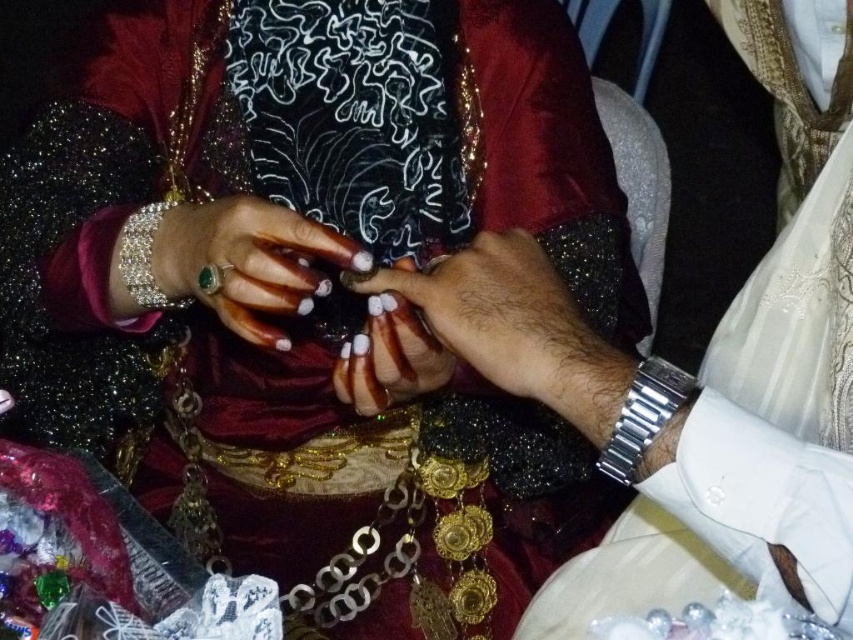
Question: Among these points, which one is farthest from the camera?

Choices:
 (A) (498, 380)
 (B) (375, 333)
 (C) (560, 323)
 (D) (259, 307)

Answer: (B)

Question: Which point is farther to the camera?

Choices:
 (A) silver metallic bracelet at left
 (B) shiny black glove at center
 (C) shiny gold necklace at center

Answer: (A)

Question: Which point appears closest to the camera in this image?

Choices:
 (A) (531, 253)
 (B) (165, 202)
 (C) (315, 280)
 (D) (654, 365)

Answer: (D)

Question: Does shiny black glove at center have a larger size compared to silver metallic bracelet at left?

Choices:
 (A) no
 (B) yes

Answer: (B)

Question: Does shiny gold necklace at center appear under white matte nail polish at center?

Choices:
 (A) no
 (B) yes

Answer: (A)

Question: In this image, where is shiny gold necklace at center located relative to matte gold ring at center?

Choices:
 (A) right
 (B) left

Answer: (A)